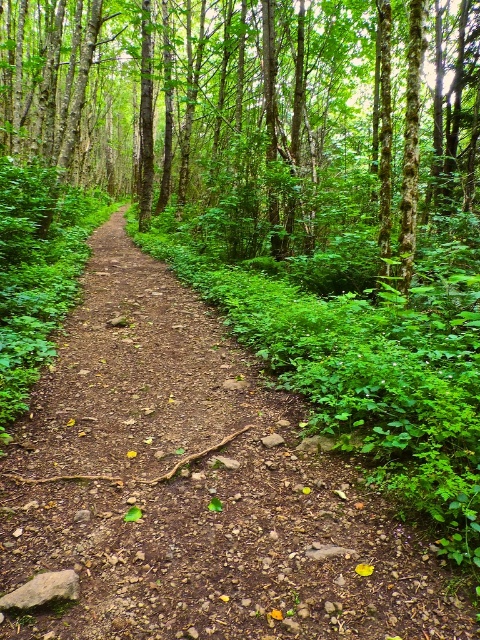
Question: Among these points, which one is nearest to the camera?

Choices:
 (A) (321, 616)
 (B) (327, 4)

Answer: (A)

Question: Is brown dirt path at center smaller than brown rough tree at center?

Choices:
 (A) no
 (B) yes

Answer: (B)

Question: Which of the following is the farthest from the observer?

Choices:
 (A) brown dirt path at center
 (B) brown rough tree at center

Answer: (B)

Question: From the image, what is the correct spatial relationship of brown dirt path at center in relation to brown rough tree at center?

Choices:
 (A) right
 (B) left

Answer: (B)

Question: Which point is closer to the camera?

Choices:
 (A) brown dirt path at center
 (B) brown rough tree at center

Answer: (A)

Question: Can you confirm if brown dirt path at center is wider than brown rough tree at center?

Choices:
 (A) yes
 (B) no

Answer: (B)